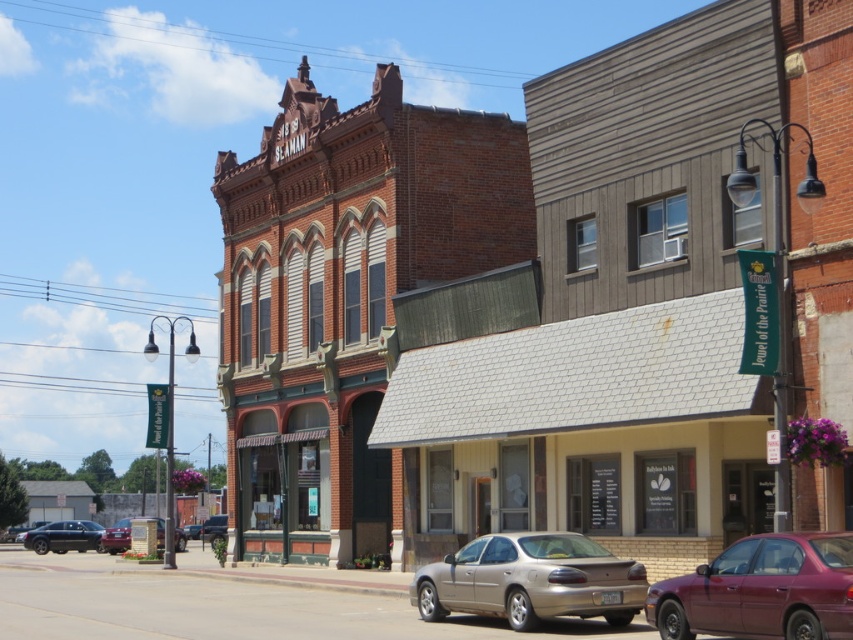
Is gold metallic sedan at center positioned before metallic silver sedan at center?

Yes, it is in front of metallic silver sedan at center.

Can you confirm if gold metallic sedan at center is shorter than metallic silver sedan at center?

In fact, gold metallic sedan at center may be taller than metallic silver sedan at center.

Find the location of a particular element. The height and width of the screenshot is (640, 853). gold metallic sedan at center is located at coordinates (531, 580).

Find the location of a particular element. The width and height of the screenshot is (853, 640). gold metallic sedan at center is located at coordinates (531, 580).

Is point (822, 621) in front of point (54, 532)?

Yes, point (822, 621) is closer to viewer.

Is maroon metallic sedan at lower right to the right of shiny black sedan at lower left from the viewer's perspective?

Indeed, maroon metallic sedan at lower right is positioned on the right side of shiny black sedan at lower left.

Identify the location of maroon metallic sedan at lower right. (762, 589).

Locate an element on the screen. maroon metallic sedan at lower right is located at coordinates (762, 589).

This screenshot has width=853, height=640. Find the location of `maroon metallic sedan at lower right`. maroon metallic sedan at lower right is located at coordinates (762, 589).

Is point (688, 616) in front of point (107, 550)?

Yes, it is.

The height and width of the screenshot is (640, 853). Describe the element at coordinates (762, 589) in the screenshot. I see `maroon metallic sedan at lower right` at that location.

I want to click on maroon metallic sedan at lower right, so click(762, 589).